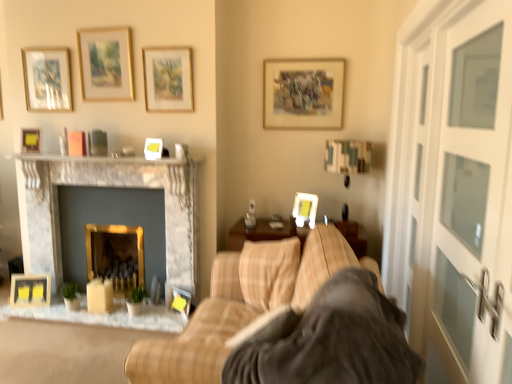
Identify the location of free region on the left part of matte black picture frame at lower center, the 8th picture frame positioned from the left. (159, 311).